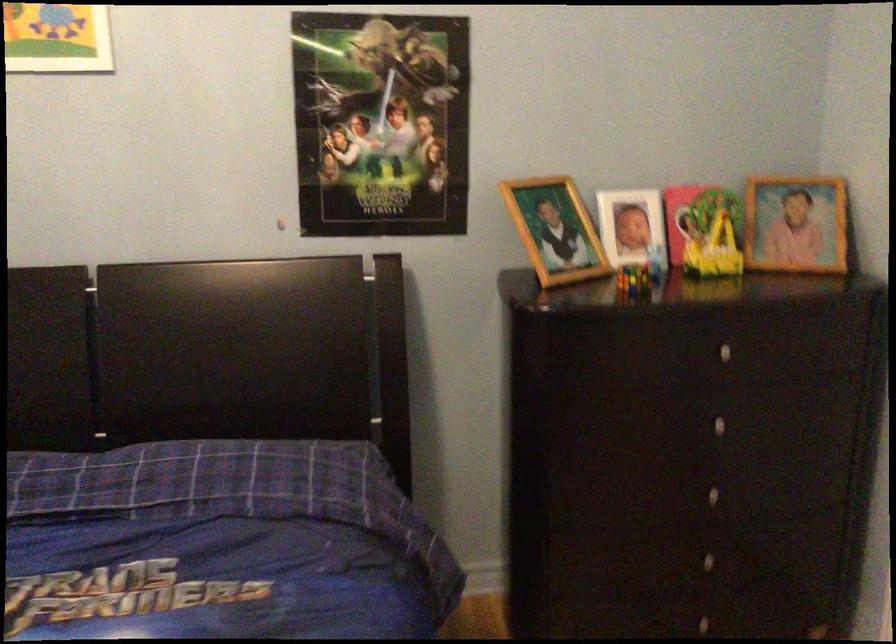
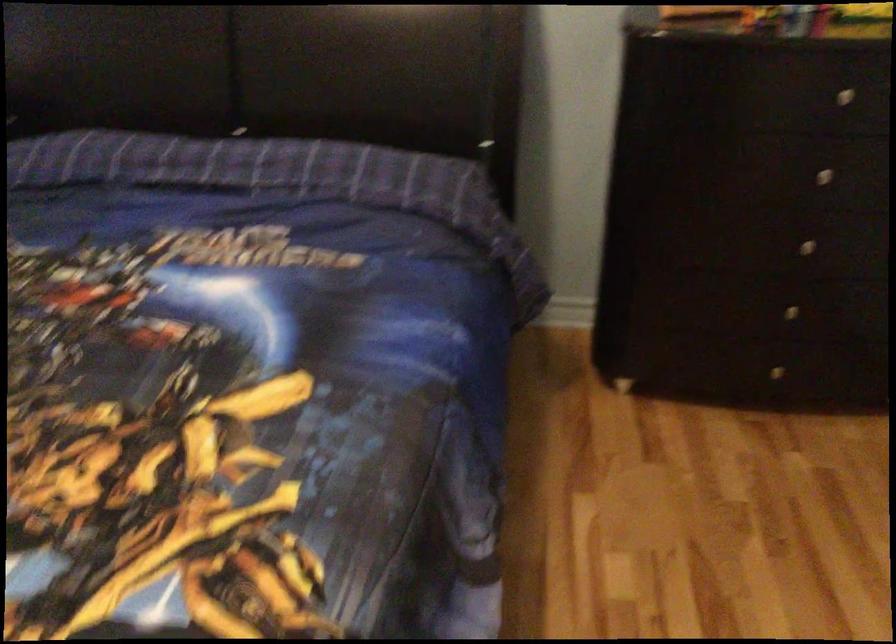
The point at (737,344) is marked in the first image. Where is the corresponding point in the second image?

(858, 91)